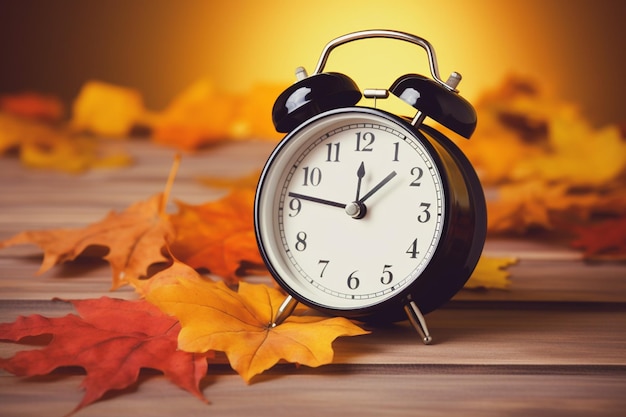
Find the location of a particular element. The image size is (626, 417). clock body is located at coordinates (458, 204).